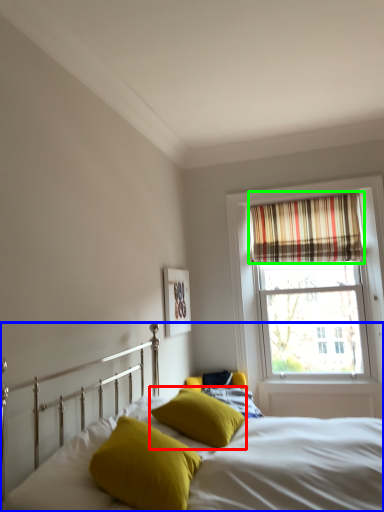
Question: Estimate the real-world distances between objects in this image. Which object is closer to pillow (highlighted by a red box), bed (highlighted by a blue box) or curtain (highlighted by a green box)?

Choices:
 (A) bed
 (B) curtain

Answer: (A)